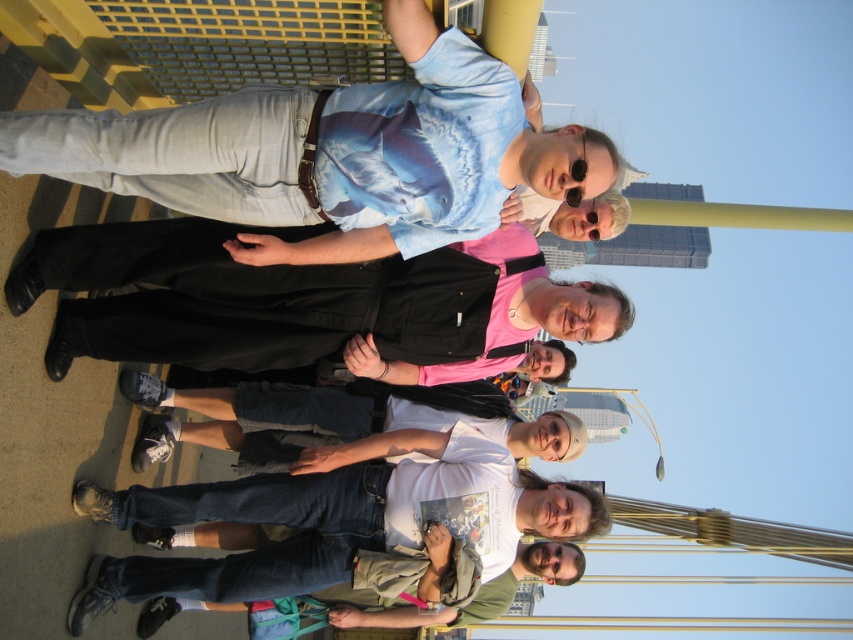
You are standing at the position of point (247,324) and want to take a photo of the group. Which direction should you move to get a better view of the group without blocking the view of point (505,90)?

Since point (505,90) is in front of point (247,324), you should move backward to avoid blocking the view of point (505,90) while capturing the group.